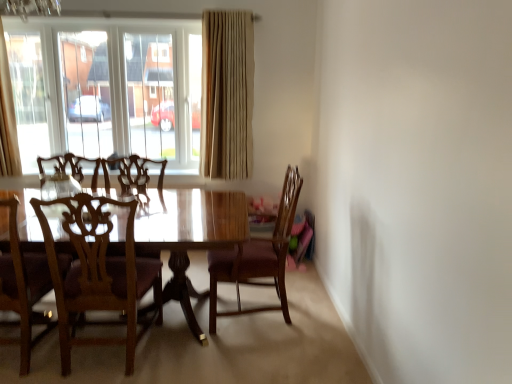
Question: Does point coord(140,26) appear closer or farther from the camera than point coord(285,301)?

Choices:
 (A) closer
 (B) farther

Answer: (B)

Question: Is transparent glass window at upper left inside or outside of wooden chair at center, which ranks as the third chair in left-to-right order?

Choices:
 (A) inside
 (B) outside

Answer: (B)

Question: Based on their relative distances, which object is farther from the transparent glass window at upper left?

Choices:
 (A) wooden chair at left, the 1th chair from the left
 (B) wooden chair at left, which is the 2th chair from right to left
 (C) beige fabric curtain at upper center, arranged as the first curtain when viewed from the right
 (D) beige fabric curtain at upper left, the first curtain positioned from the left
 (E) wooden chair at center, which ranks as the third chair in left-to-right order

Answer: (E)

Question: Which object is the closest to the beige fabric curtain at upper left, which ranks as the second curtain in right-to-left order?

Choices:
 (A) transparent glass window at upper left
 (B) wooden chair at left, placed as the 2th chair when sorted from left to right
 (C) beige fabric curtain at upper center, positioned as the 2th curtain in left-to-right order
 (D) wooden chair at left, arranged as the 3th chair when viewed from the right
 (E) wooden chair at center, which appears as the 1th chair when viewed from the right

Answer: (A)